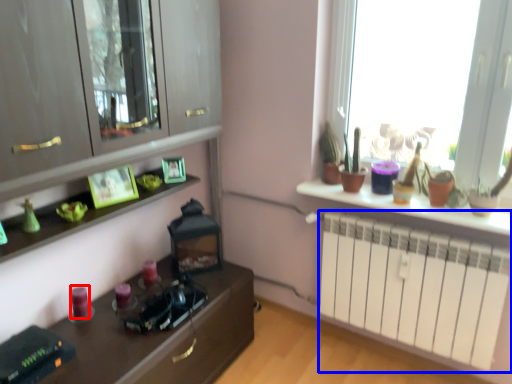
Question: Which of the following is the farthest to the observer, candle (highlighted by a red box) or radiator (highlighted by a blue box)?

Choices:
 (A) candle
 (B) radiator

Answer: (A)